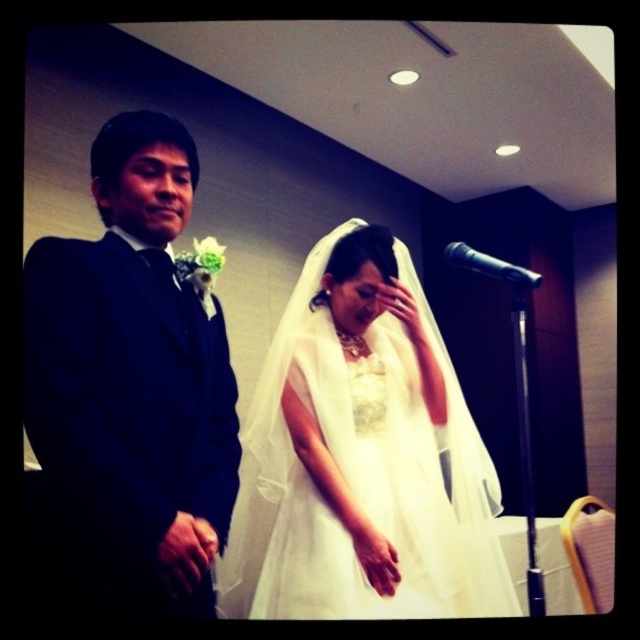
You are standing at point (170, 323) and want to move to point (484, 556). Is the path directly ahead of you clear? Please explain.

A: Point (484, 556) is behind point (170, 323), so moving directly ahead would not reach the target point. The path is blocked because the destination is behind your current position.

You are a photographer at the wedding and need to frame both the white sheer dress at center and the matte black suit at left in a single shot. Considering their sizes, which one should you focus on to ensure both are visible without cropping?

The white sheer dress at center is wider than the matte black suit at left, so you should focus on the center where the white sheer dress is located to accommodate its larger width while still including the matte black suit at left in the frame.